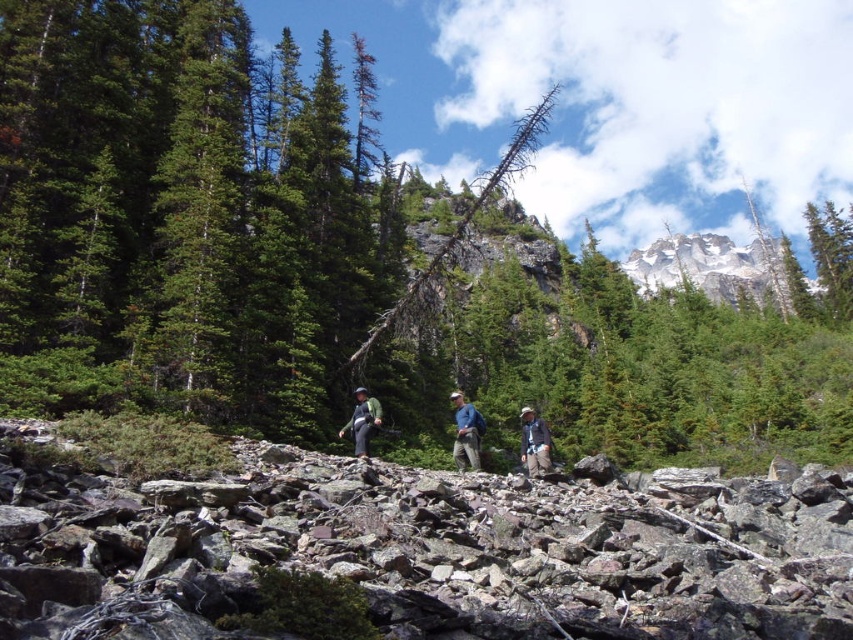
Does green textured tree at center have a greater height compared to snowy granite peak at upper right?

Yes, green textured tree at center is taller than snowy granite peak at upper right.

Between green textured tree at center and snowy granite peak at upper right, which one has less height?

snowy granite peak at upper right is shorter.

Is point (439, 365) closer to viewer compared to point (656, 260)?

Yes, it is.

This screenshot has height=640, width=853. What are the coordinates of `green textured tree at center` in the screenshot? It's located at (349, 262).

Which of these two, snowy granite peak at upper right or green fabric backpack at center, stands taller?

With more height is snowy granite peak at upper right.

Which is more to the left, snowy granite peak at upper right or green fabric backpack at center?

green fabric backpack at center is more to the left.

Is point (627, 257) closer to viewer compared to point (363, 452)?

No, it is not.

The image size is (853, 640). In order to click on snowy granite peak at upper right in this screenshot , I will do `click(712, 268)`.

Between light blue fabric shirt at center and khaki pants at center, which one is positioned higher?

light blue fabric shirt at center is higher up.

Is point (457, 458) positioned behind point (527, 422)?

Yes, it is behind point (527, 422).

Locate an element on the screen. light blue fabric shirt at center is located at coordinates click(x=466, y=433).